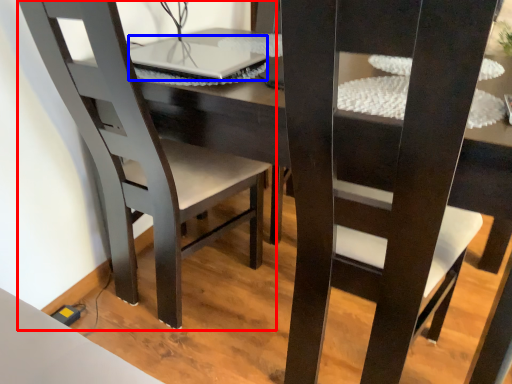
Question: Which point is further to the camera, chair (highlighted by a red box) or laptop (highlighted by a blue box)?

Choices:
 (A) chair
 (B) laptop

Answer: (B)